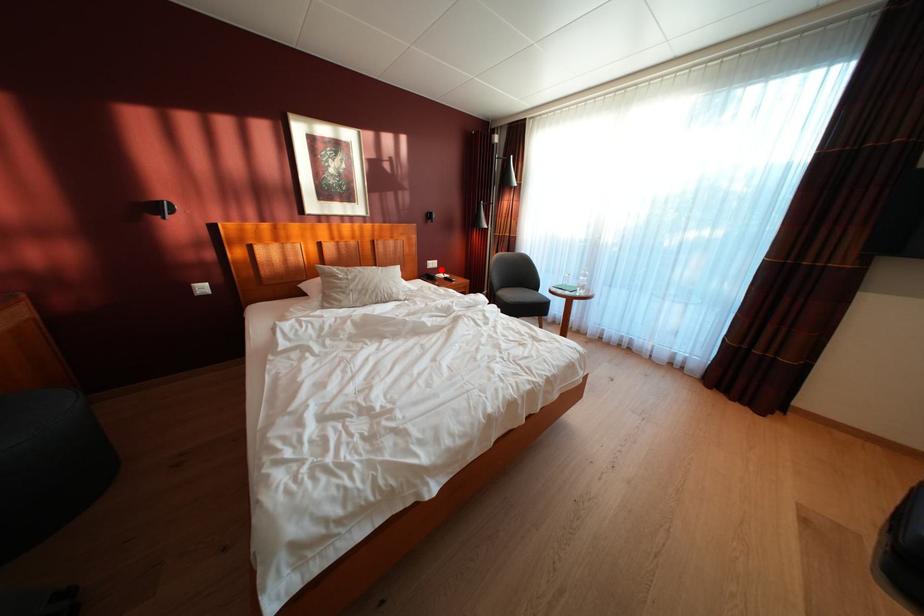
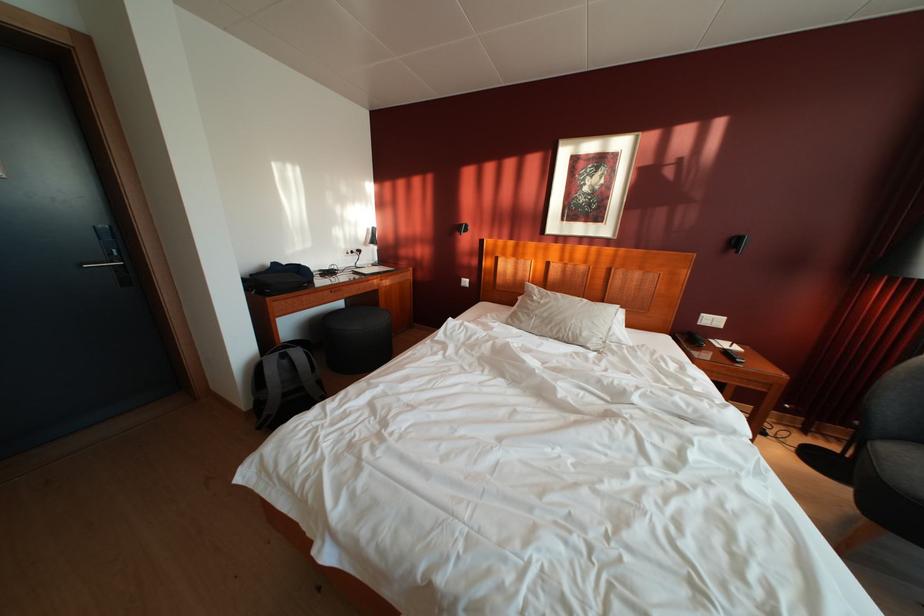
Find the pixel in the second image that matches the highlighted location in the first image.

(721, 326)